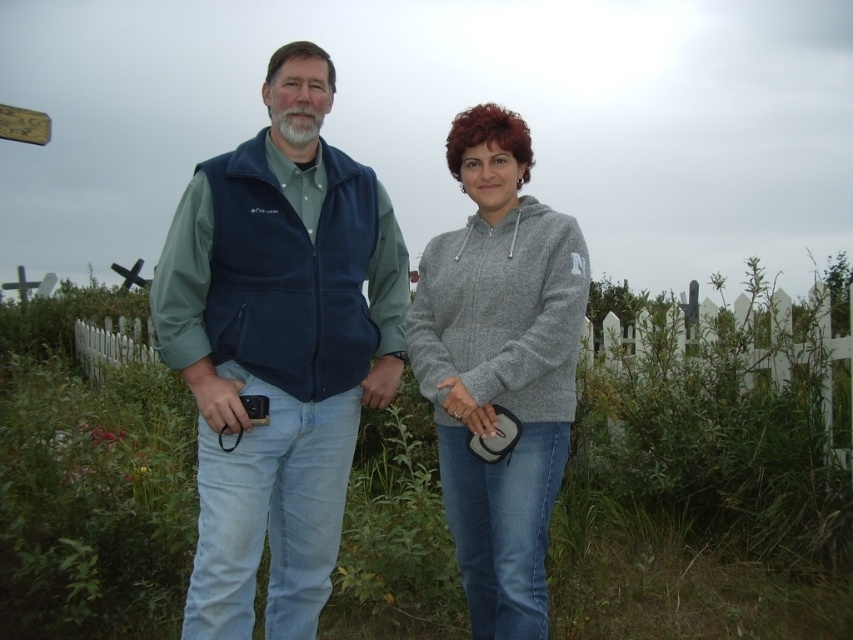
You are a fashion designer observing two models wearing the navy blue fleece vest at center and the gray fleece hoodie at center. Based on their positioning, which clothing item is positioned higher on the body?

The navy blue fleece vest at center is located above the gray fleece hoodie at center, so the navy blue fleece vest at center is positioned higher on the body.

You are a photographer trying to capture a photo of the two people in the scene. You want to ensure both are in focus. Given that your camera can only focus on objects at a specific distance, which point should you focus on to ensure both the person on the left and the person on the right are in focus? The points are labeled as point 1 at coordinates point [230,333] and point 2 at coordinates point [521,499].

You should focus on point 1 at coordinates point [230,333] because it is closer to the camera than point 2 at coordinates point [521,499]. This will ensure both the person on the left and the right are in focus as the focus distance can cover the range between them.